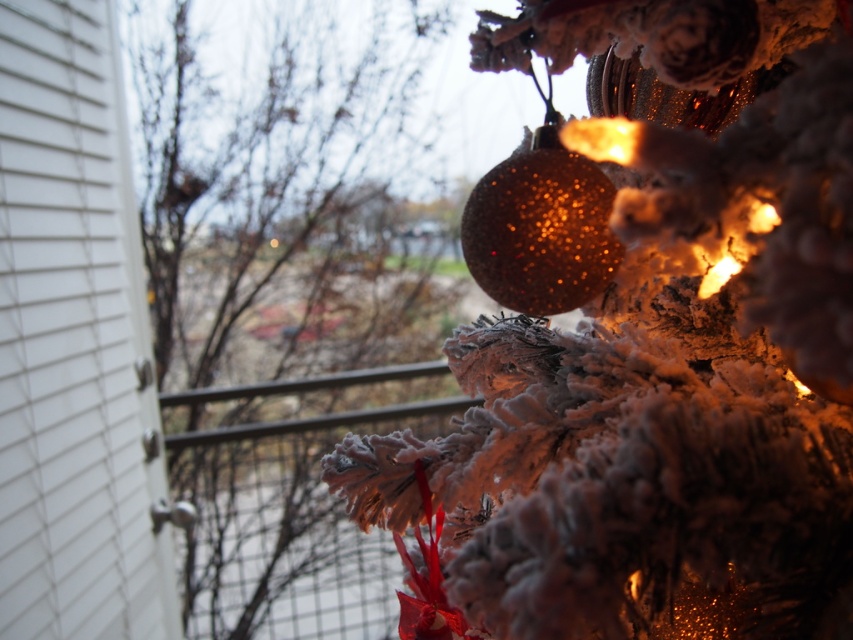
You are standing in front of the Christmas tree and want to place a new decoration between the sparkling gold ornament at upper right and the frosted pine cone at right. Based on their positions, where should you place the new decoration?

The sparkling gold ornament at upper right is to the right of the frosted pine cone at right, so you should place the new decoration between them on the right side of the frosted pine cone at right and to the left of the sparkling gold ornament at upper right.

You are a child who wants to reach both the frosted pine cone at right and the glittery gold ornament at upper center on the Christmas tree. Which one is closer to you?

The frosted pine cone at right is closer to you since it is 1.53 meters away from the glittery gold ornament at upper center, meaning it is nearer than the ornament.

You are a window cleaner standing at the base of the house. You need to clean both the white textured siding at left and the glittery gold ornament at upper center. Which object will require you to climb higher to reach?

The white textured siding at left requires climbing higher because it is much taller than the glittery gold ornament at upper center according to the description.